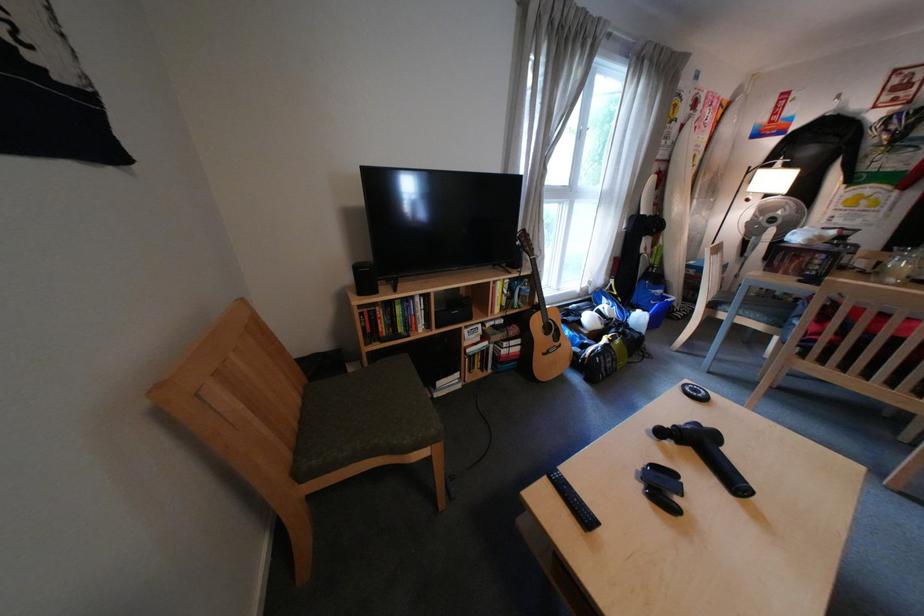
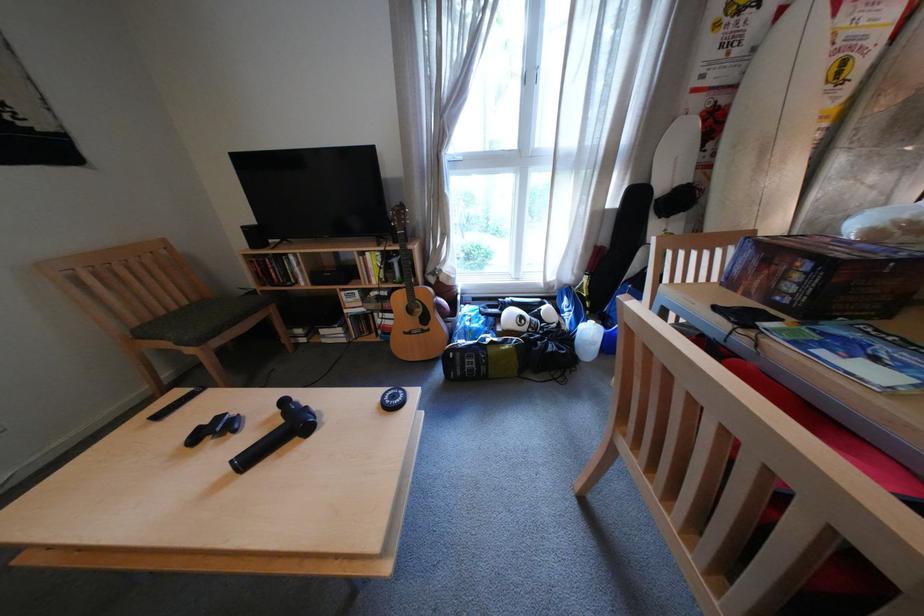
In the second image, find the point that corresponds to (558,353) in the first image.

(420, 331)